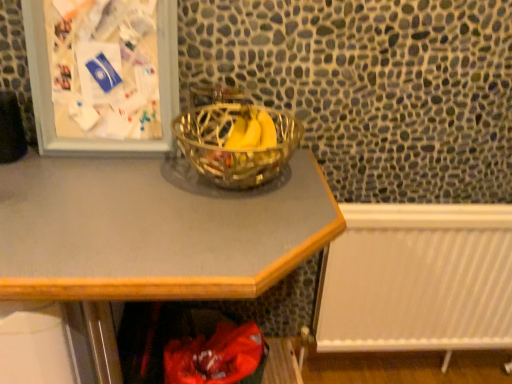
Question: From the image's perspective, is clear glass bowl at center over metallic gray desk at center?

Choices:
 (A) no
 (B) yes

Answer: (B)

Question: From the image's perspective, does clear glass bowl at center appear lower than metallic gray desk at center?

Choices:
 (A) no
 (B) yes

Answer: (A)

Question: Is clear glass bowl at center further to the viewer compared to metallic gray desk at center?

Choices:
 (A) no
 (B) yes

Answer: (B)

Question: Is metallic gray desk at center surrounded by clear glass bowl at center?

Choices:
 (A) yes
 (B) no

Answer: (B)

Question: Is clear glass bowl at center touching metallic gray desk at center?

Choices:
 (A) yes
 (B) no

Answer: (B)

Question: Does clear glass bowl at center have a greater height compared to metallic gray desk at center?

Choices:
 (A) yes
 (B) no

Answer: (B)

Question: Are white plastic radiator at lower right and metallic silver picture frame at upper left located far from each other?

Choices:
 (A) yes
 (B) no

Answer: (B)

Question: Considering the relative positions of white plastic radiator at lower right and metallic silver picture frame at upper left in the image provided, is white plastic radiator at lower right to the right of metallic silver picture frame at upper left from the viewer's perspective?

Choices:
 (A) no
 (B) yes

Answer: (B)

Question: Is metallic silver picture frame at upper left completely or partially inside white plastic radiator at lower right?

Choices:
 (A) no
 (B) yes

Answer: (A)

Question: Can you confirm if white plastic radiator at lower right is shorter than metallic silver picture frame at upper left?

Choices:
 (A) yes
 (B) no

Answer: (B)

Question: From the image's perspective, is white plastic radiator at lower right beneath metallic silver picture frame at upper left?

Choices:
 (A) yes
 (B) no

Answer: (A)

Question: Can you confirm if white plastic radiator at lower right is thinner than metallic silver picture frame at upper left?

Choices:
 (A) no
 (B) yes

Answer: (B)

Question: Can you see metallic gray desk at center touching metallic silver picture frame at upper left?

Choices:
 (A) yes
 (B) no

Answer: (B)